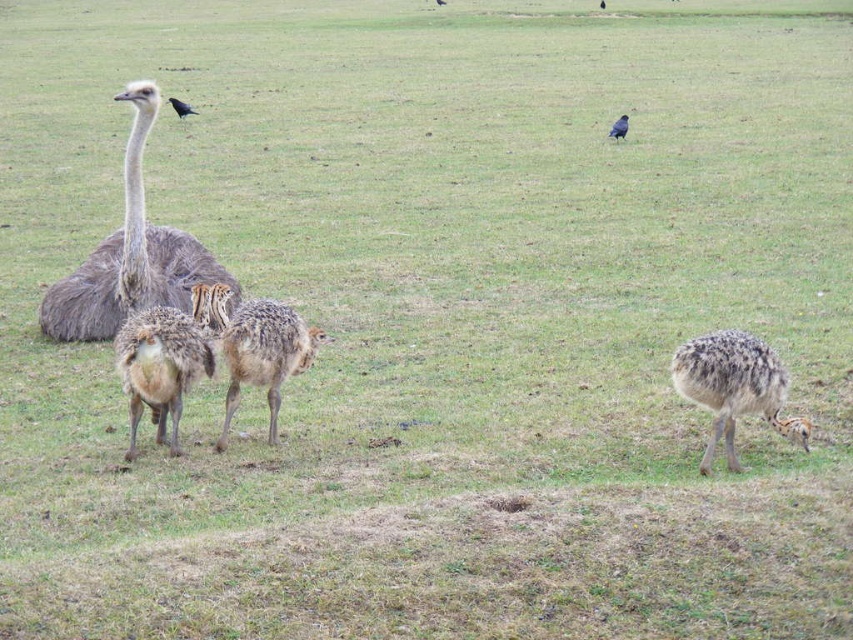
You are standing in the field and want to approach both the gray feathered ostrich at left and the speckled feathered ostrich at right. Which ostrich should you target first to reach the closer one?

You should target the gray feathered ostrich at left first because it is closer to you than the speckled feathered ostrich at right.

Looking at this image, you are standing at the origin point of the field, which is at coordinate point 0,0. You want to walk to the speckled feathered ostrich at center. What direction should you head towards?

The speckled feathered ostrich at center is located at coordinate point (x=259, y=349), so you should head northeast to reach it.